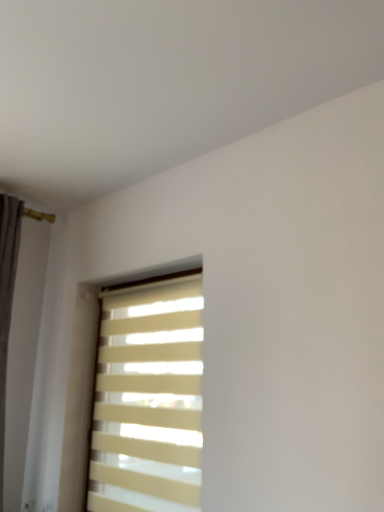
Question: Should I look upward or downward to see beige fabric blinds at center?

Choices:
 (A) up
 (B) down

Answer: (B)

Question: Is white matte shutter at left looking in the opposite direction of beige fabric blinds at center?

Choices:
 (A) no
 (B) yes

Answer: (A)

Question: Is white matte shutter at left wider than beige fabric blinds at center?

Choices:
 (A) no
 (B) yes

Answer: (A)

Question: Can you confirm if white matte shutter at left is shorter than beige fabric blinds at center?

Choices:
 (A) yes
 (B) no

Answer: (B)

Question: From the image's perspective, is white matte shutter at left on top of beige fabric blinds at center?

Choices:
 (A) yes
 (B) no

Answer: (A)

Question: Is white matte shutter at left with beige fabric blinds at center?

Choices:
 (A) yes
 (B) no

Answer: (B)

Question: Is white matte shutter at left far away from beige fabric blinds at center?

Choices:
 (A) no
 (B) yes

Answer: (A)

Question: Is beige fabric blinds at center smaller than white matte shutter at left?

Choices:
 (A) no
 (B) yes

Answer: (B)

Question: Considering the relative sizes of beige fabric blinds at center and white matte shutter at left in the image provided, is beige fabric blinds at center thinner than white matte shutter at left?

Choices:
 (A) no
 (B) yes

Answer: (A)

Question: Does beige fabric blinds at center have a greater height compared to white matte shutter at left?

Choices:
 (A) no
 (B) yes

Answer: (A)

Question: Would you say beige fabric blinds at center is outside white matte shutter at left?

Choices:
 (A) no
 (B) yes

Answer: (B)

Question: Is beige fabric blinds at center looking in the opposite direction of white matte shutter at left?

Choices:
 (A) yes
 (B) no

Answer: (B)

Question: From the image's perspective, is beige fabric blinds at center on white matte shutter at left?

Choices:
 (A) yes
 (B) no

Answer: (B)

Question: In terms of size, does white matte shutter at left appear bigger or smaller than beige fabric blinds at center?

Choices:
 (A) big
 (B) small

Answer: (A)